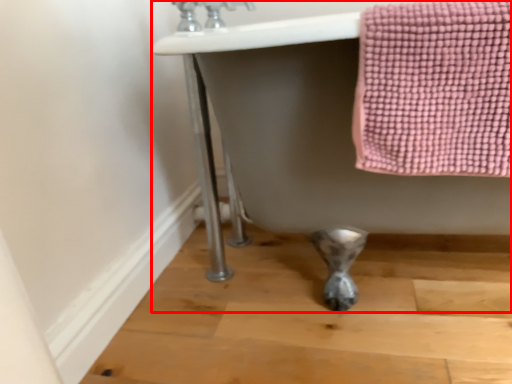
Question: Observing the image, what is the correct spatial positioning of bath (annotated by the red box) in reference to faucet?

Choices:
 (A) left
 (B) right

Answer: (B)